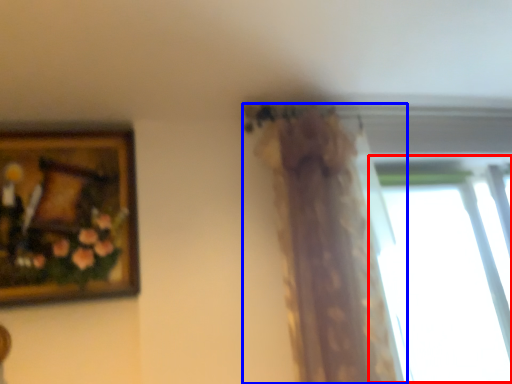
Question: Which object appears closest to the camera in this image, window (highlighted by a red box) or curtain (highlighted by a blue box)?

Choices:
 (A) window
 (B) curtain

Answer: (B)